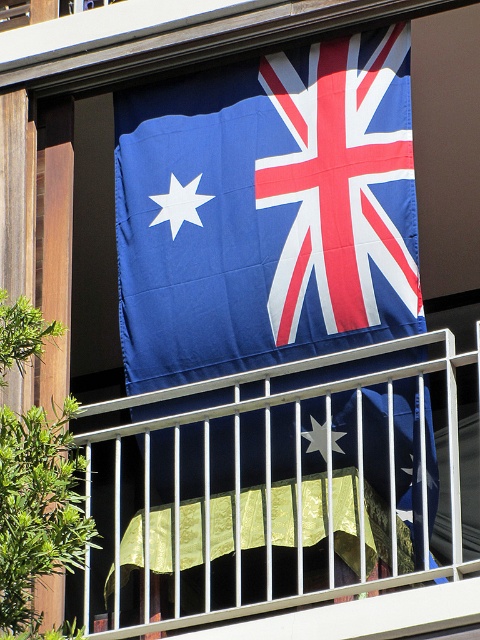
Which is above, blue fabric flag at upper center or metallic silver balustrade at upper center?

Positioned higher is blue fabric flag at upper center.

Does point (367, 184) come behind point (391, 611)?

Yes, point (367, 184) is behind point (391, 611).

At what (x,y) coordinates should I click in order to perform the action: click on blue fabric flag at upper center. Please return your answer as a coordinate pair (x, y). Image resolution: width=480 pixels, height=640 pixels. Looking at the image, I should click on (267, 212).

I want to click on blue fabric flag at upper center, so click(267, 212).